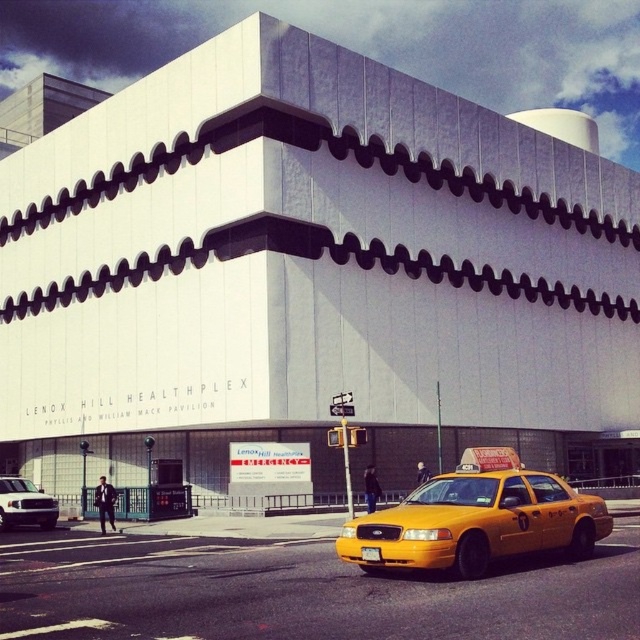
Question: Which object appears farthest from the camera in this image?

Choices:
 (A) white matte truck at lower left
 (B) yellow matte taxi at center

Answer: (A)

Question: Which point is closer to the camera?

Choices:
 (A) yellow matte taxi at center
 (B) white matte truck at lower left

Answer: (A)

Question: Is yellow matte taxi at center wider than white matte truck at lower left?

Choices:
 (A) no
 (B) yes

Answer: (B)

Question: From the image, what is the correct spatial relationship of yellow matte taxi at center in relation to white matte truck at lower left?

Choices:
 (A) left
 (B) right

Answer: (B)

Question: Does yellow matte taxi at center have a greater width compared to white matte truck at lower left?

Choices:
 (A) no
 (B) yes

Answer: (B)